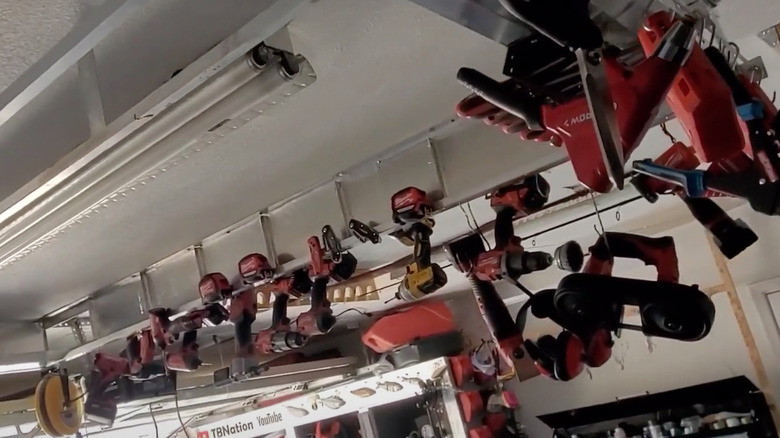
Identify the location of overhead lights. (225, 105).